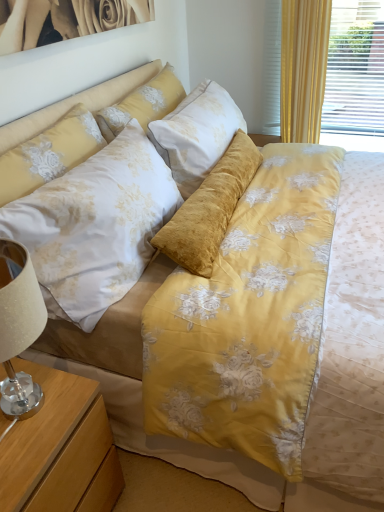
Question: Is floral fabric pillow at upper center, positioned as the 1th pillow in back-to-front order, directly adjacent to floral satin pillow at upper left, the 1th pillow from the front?

Choices:
 (A) no
 (B) yes

Answer: (A)

Question: From a real-world perspective, is floral fabric pillow at upper center, which is the 2th pillow in front-to-back order, below floral satin pillow at upper left, placed as the 2th pillow when sorted from back to front?

Choices:
 (A) no
 (B) yes

Answer: (A)

Question: Is floral fabric pillow at upper center, which is the 2th pillow in front-to-back order, wider than floral satin pillow at upper left, the 1th pillow from the front?

Choices:
 (A) no
 (B) yes

Answer: (B)

Question: Can you confirm if floral fabric pillow at upper center, positioned as the 1th pillow in back-to-front order, is bigger than floral satin pillow at upper left, placed as the 2th pillow when sorted from back to front?

Choices:
 (A) yes
 (B) no

Answer: (B)

Question: Considering the relative positions of floral fabric pillow at upper center, positioned as the 1th pillow in back-to-front order, and floral satin pillow at upper left, placed as the 2th pillow when sorted from back to front, in the image provided, is floral fabric pillow at upper center, positioned as the 1th pillow in back-to-front order, to the left of floral satin pillow at upper left, placed as the 2th pillow when sorted from back to front, from the viewer's perspective?

Choices:
 (A) no
 (B) yes

Answer: (A)

Question: Considering the positions of floral satin pillow at upper left, the 1th pillow from the front, and wooden nightstand at lower left in the image, is floral satin pillow at upper left, the 1th pillow from the front, bigger or smaller than wooden nightstand at lower left?

Choices:
 (A) small
 (B) big

Answer: (A)

Question: Looking at their shapes, would you say floral satin pillow at upper left, placed as the 2th pillow when sorted from back to front, is wider or thinner than wooden nightstand at lower left?

Choices:
 (A) wide
 (B) thin

Answer: (B)

Question: Is point (21, 160) positioned closer to the camera than point (13, 455)?

Choices:
 (A) farther
 (B) closer

Answer: (A)

Question: From the image's perspective, is floral satin pillow at upper left, placed as the 2th pillow when sorted from back to front, above or below wooden nightstand at lower left?

Choices:
 (A) below
 (B) above

Answer: (B)

Question: Considering their positions, is wooden nightstand at lower left located in front of or behind floral fabric pillow at upper center, positioned as the 1th pillow in back-to-front order?

Choices:
 (A) behind
 (B) front

Answer: (B)

Question: In the image, is wooden nightstand at lower left on the left side or the right side of floral fabric pillow at upper center, which is the 2th pillow in front-to-back order?

Choices:
 (A) right
 (B) left

Answer: (B)

Question: From a real-world perspective, is wooden nightstand at lower left physically located above or below floral fabric pillow at upper center, positioned as the 1th pillow in back-to-front order?

Choices:
 (A) above
 (B) below

Answer: (B)

Question: From the image's perspective, relative to floral fabric pillow at upper center, positioned as the 1th pillow in back-to-front order, is wooden nightstand at lower left above or below?

Choices:
 (A) below
 (B) above

Answer: (A)

Question: In the image, is floral fabric pillow at upper center, positioned as the 1th pillow in back-to-front order, positioned in front of or behind wooden nightstand at lower left?

Choices:
 (A) behind
 (B) front

Answer: (A)

Question: Do you think floral fabric pillow at upper center, positioned as the 1th pillow in back-to-front order, is within wooden nightstand at lower left, or outside of it?

Choices:
 (A) outside
 (B) inside

Answer: (A)